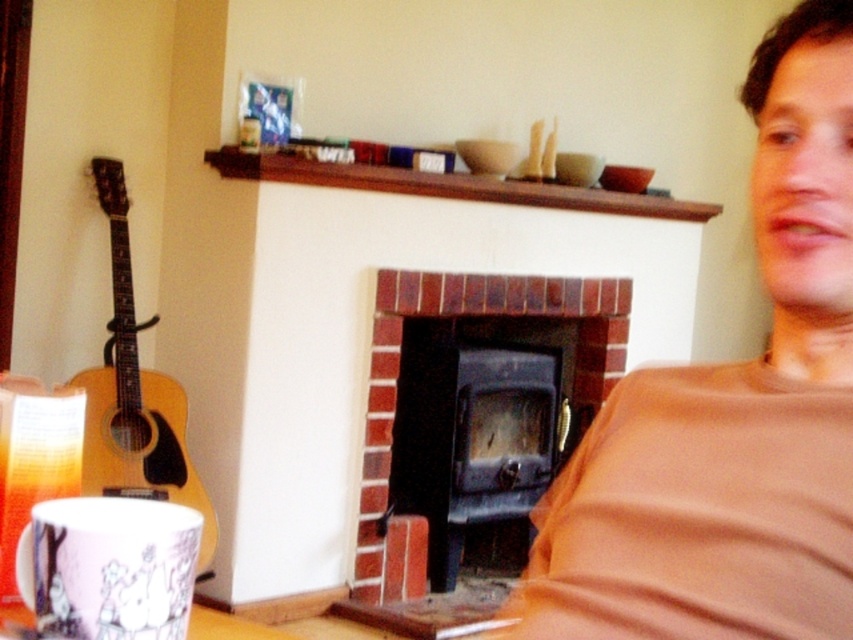
Which is above, brown cotton shirt at right or acoustic wood guitar at left?

brown cotton shirt at right is above.

Can you confirm if brown cotton shirt at right is positioned above acoustic wood guitar at left?

Yes, brown cotton shirt at right is above acoustic wood guitar at left.

Identify the location of brown cotton shirt at right. (730, 413).

Is porcelain mug with illustrations at lower left further to camera compared to acoustic wood guitar at left?

No, porcelain mug with illustrations at lower left is closer to the viewer.

In order to click on porcelain mug with illustrations at lower left in this screenshot , I will do `click(113, 566)`.

Locate an element on the screen. This screenshot has height=640, width=853. porcelain mug with illustrations at lower left is located at coordinates (113, 566).

Does brick fireplace at center have a larger size compared to acoustic wood guitar at left?

Yes.

Is brick fireplace at center to the left of acoustic wood guitar at left from the viewer's perspective?

No, brick fireplace at center is not to the left of acoustic wood guitar at left.

Find the location of a particular element. brick fireplace at center is located at coordinates (473, 333).